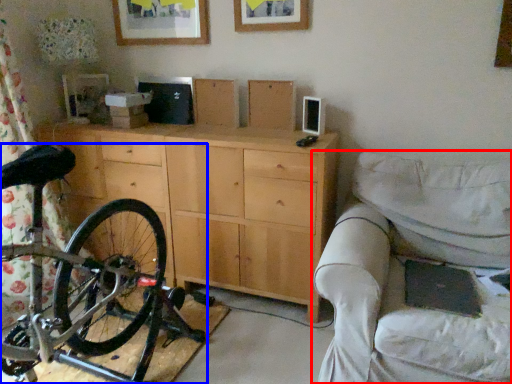
Question: Among these objects, which one is farthest to the camera, studio couch (highlighted by a red box) or bicycle (highlighted by a blue box)?

Choices:
 (A) studio couch
 (B) bicycle

Answer: (A)